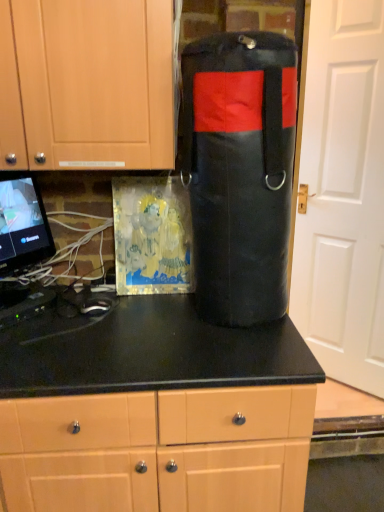
This screenshot has width=384, height=512. I want to click on free space to the left of black leather punching bag at center, so click(158, 322).